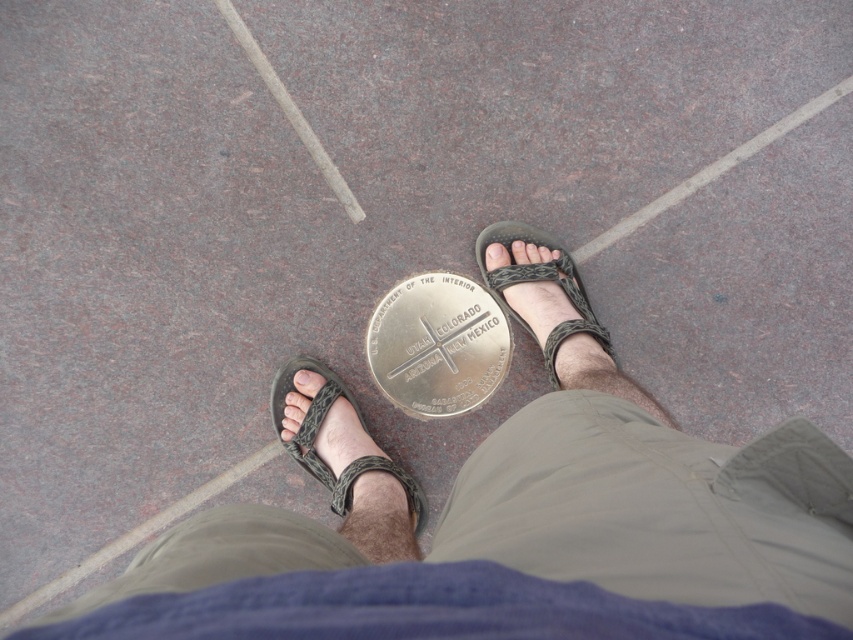
Question: Based on their relative distances, which object is nearer to the textured gray sandal at center?

Choices:
 (A) matte gray toe at center
 (B) matte black toe at lower left
 (C) white matte toe at center
 (D) matte black toe at center

Answer: (A)

Question: Is matte black toe at lower left bigger than matte black toe at center?

Choices:
 (A) yes
 (B) no

Answer: (A)

Question: Which of these objects is positioned closest to the white matte toe at center?

Choices:
 (A) matte black toe at lower left
 (B) matte black toe at center

Answer: (A)

Question: Which object is the farthest from the matte gray sandal at center?

Choices:
 (A) matte black toe at lower left
 (B) textured gray sandal at center
 (C) metallic silver medallion at center

Answer: (B)

Question: Does matte black toe at lower left have a smaller size compared to matte black toe at center?

Choices:
 (A) yes
 (B) no

Answer: (B)

Question: Considering the relative positions of matte gray toe at center and matte black toe at center in the image provided, where is matte gray toe at center located with respect to matte black toe at center?

Choices:
 (A) right
 (B) left

Answer: (A)